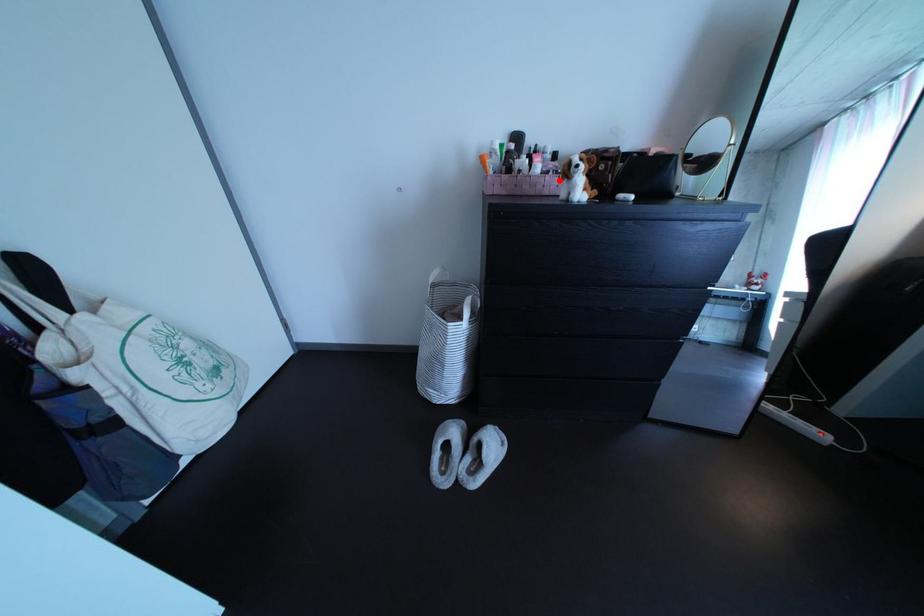
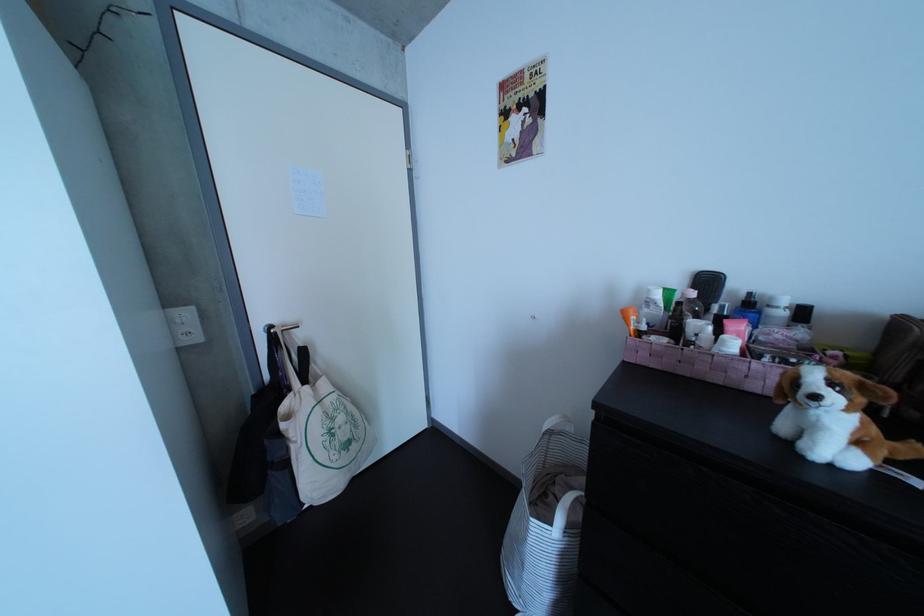
Find the pixel in the second image that matches the highlighted location in the first image.

(764, 362)